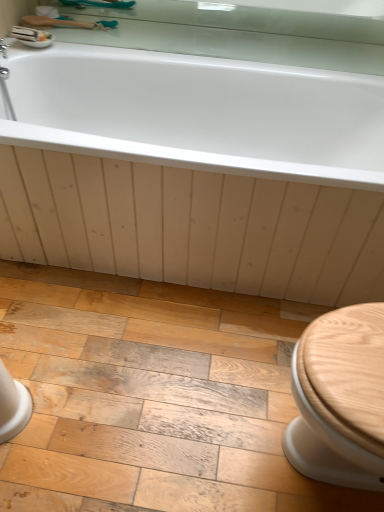
Question: Considering their positions, is clear glass mirror at upper center located in front of or behind white glossy sink at upper left?

Choices:
 (A) behind
 (B) front

Answer: (A)

Question: From the image's perspective, relative to white glossy sink at upper left, is clear glass mirror at upper center above or below?

Choices:
 (A) below
 (B) above

Answer: (B)

Question: Considering the real-world distances, which object is farthest from the clear glass mirror at upper center?

Choices:
 (A) wooden brush at upper left
 (B) wooden floor at lower center
 (C) white glossy bathtub at upper center
 (D) white glossy sink at upper left

Answer: (B)

Question: Which object is the closest to the wooden brush at upper left?

Choices:
 (A) wooden floor at lower center
 (B) white glossy bathtub at upper center
 (C) white glossy sink at upper left
 (D) clear glass mirror at upper center

Answer: (C)